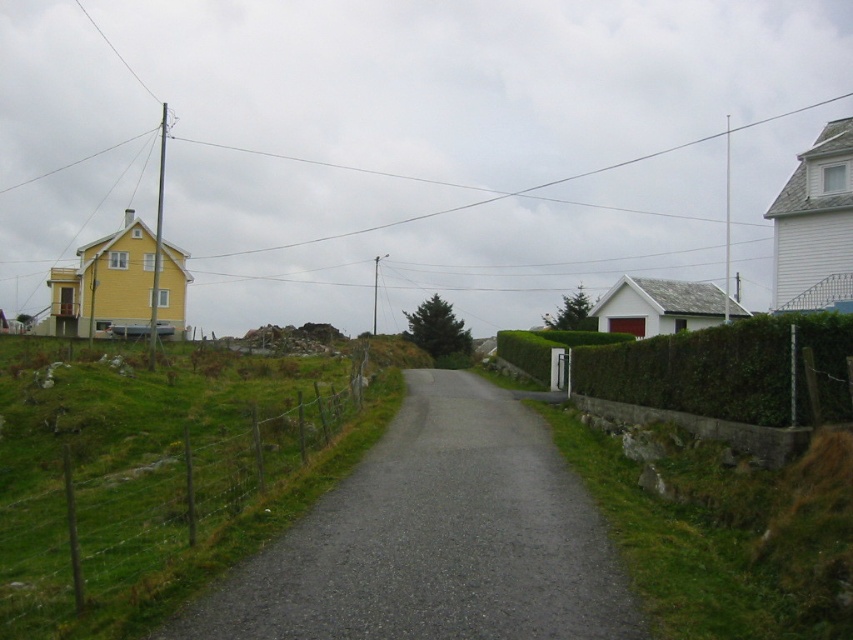
You are driving a car and need to park on the gray asphalt driveway at center. There is a green wire fence at center nearby. Which side of the driveway should you park on to avoid hitting the fence?

You should park on the left side of the gray asphalt driveway at center because the green wire fence at center is located to the right of the driveway, so parking on the left side would keep you away from the fence.

You are a delivery person trying to decide which side of the road to park your van. You need to choose between parking near the green wire fence at center or the green hedge at right. Which side has a taller barrier?

The green wire fence at center is much taller than the green hedge at right, so the green wire fence at center side has a taller barrier.

You are driving a delivery van that is 2 meters wide. You need to turn into the gray asphalt driveway at center. There is a green hedge at right nearby. Can your van fit through the driveway without hitting the hedge?

The gray asphalt driveway at center is wider than the green hedge at right, so the delivery van that is 2 meters wide can fit through the driveway without hitting the hedge.